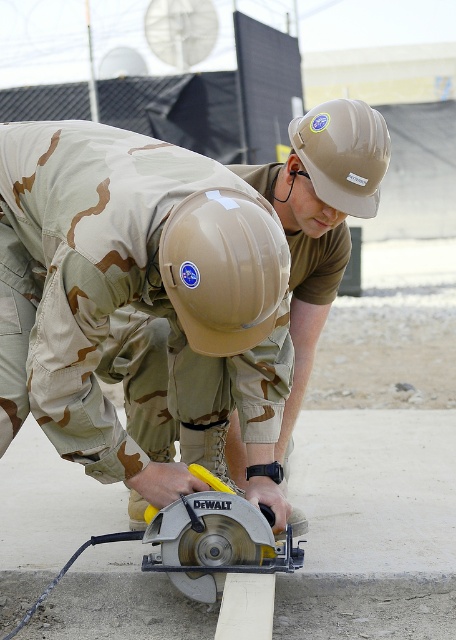
Question: Does tan matte hard hat at center come in front of tan matte hard hat at upper center?

Choices:
 (A) no
 (B) yes

Answer: (B)

Question: Does matte khaki helmet at center have a smaller size compared to yellow plastic circular saw at center?

Choices:
 (A) yes
 (B) no

Answer: (B)

Question: Does yellow plastic circular saw at center have a greater width compared to tan matte hard hat at upper center?

Choices:
 (A) no
 (B) yes

Answer: (B)

Question: Which point is farther to the camera?

Choices:
 (A) tan matte hard hat at upper center
 (B) yellow plastic circular saw at center
 (C) matte khaki helmet at center
 (D) tan matte hard hat at center

Answer: (A)

Question: Estimate the real-world distances between objects in this image. Which object is farther from the matte khaki helmet at center?

Choices:
 (A) yellow plastic circular saw at center
 (B) tan matte hard hat at center
 (C) tan matte hard hat at upper center

Answer: (C)

Question: Which point is farther to the camera?

Choices:
 (A) (278, 566)
 (B) (346, 131)
 (C) (218, 337)

Answer: (B)